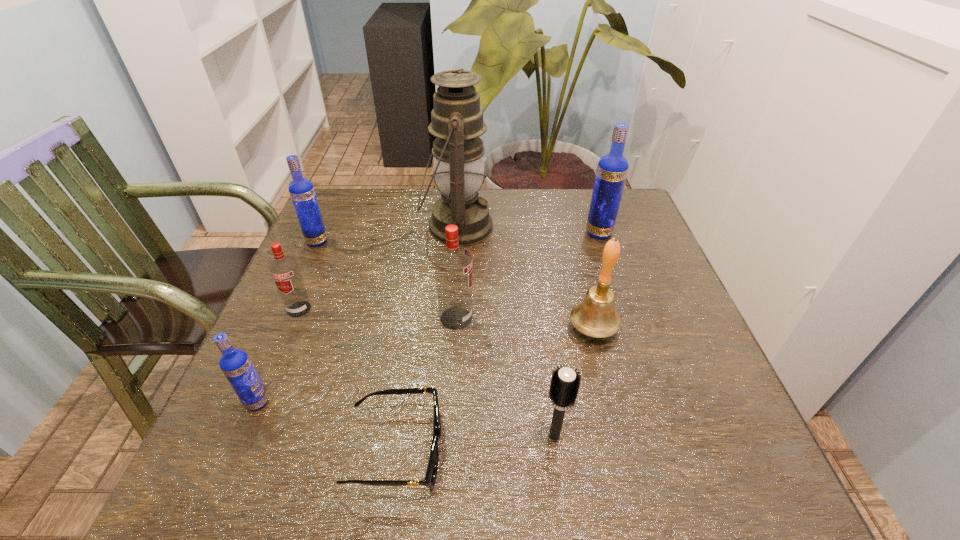
Locate an element on the screen. Image resolution: width=960 pixels, height=540 pixels. hairbrush is located at coordinates (564, 386).

Find the location of a particular element. The width and height of the screenshot is (960, 540). sunglasses is located at coordinates (431, 473).

Identify the location of the shortest object. coord(431,473).

At what (x,y) coordinates should I click in order to perform the action: click on free space located on the front of the oil lamp. Please return your answer as a coordinate pair (x, y). The width and height of the screenshot is (960, 540). Looking at the image, I should click on (448, 356).

Locate an element on the screen. The width and height of the screenshot is (960, 540). free space located 0.120m on the back of the rightmost vodka is located at coordinates (588, 201).

What are the coordinates of `blank area located 0.260m on the front of the second smallest blue vodka` in the screenshot? It's located at (280, 323).

Identify the location of vacant region located 0.160m on the front label of the bigger red vodka. (547, 318).

The height and width of the screenshot is (540, 960). I want to click on vacant region located on the front of the bell, so click(613, 408).

Locate an element on the screen. vacant space positioned on the back of the nearest vodka is located at coordinates [x=292, y=320].

Where is `free space located on the front label of the left red vodka`? Image resolution: width=960 pixels, height=540 pixels. free space located on the front label of the left red vodka is located at coordinates (285, 343).